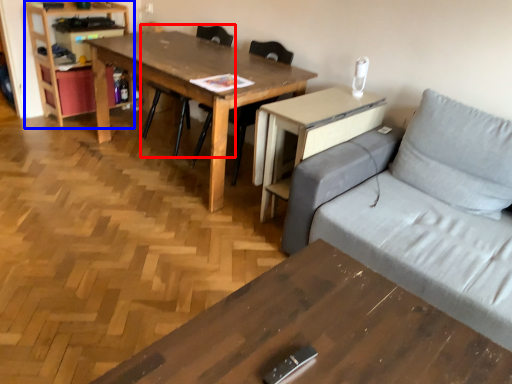
Question: Which point is closer to the camera, chair (highlighted by a red box) or bookshelf (highlighted by a blue box)?

Choices:
 (A) chair
 (B) bookshelf

Answer: (A)